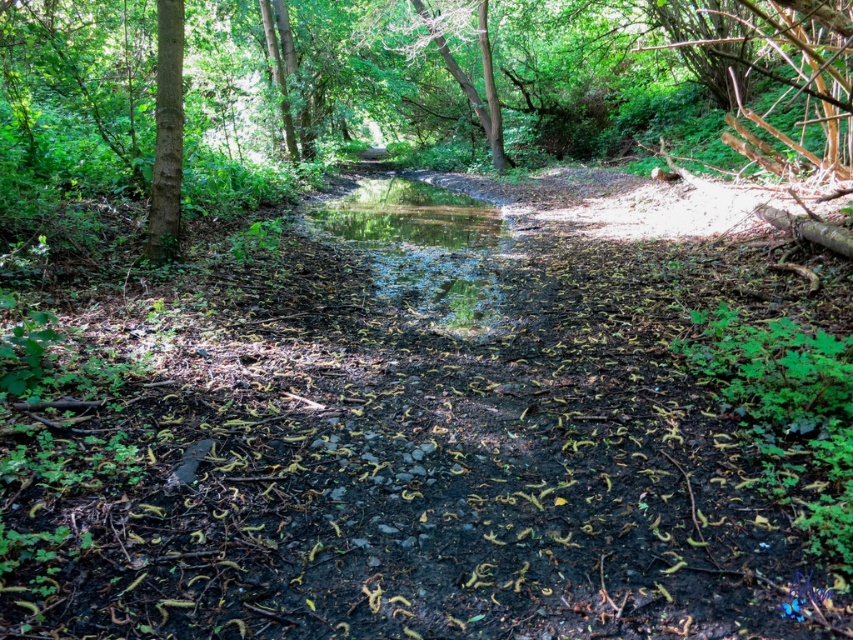
Question: Is green reflective water at center bigger than smooth bark tree at left?

Choices:
 (A) yes
 (B) no

Answer: (A)

Question: From the image, what is the correct spatial relationship of green reflective water at center in relation to smooth bark tree at left?

Choices:
 (A) above
 (B) below

Answer: (B)

Question: Which of the following is the closest to the observer?

Choices:
 (A) (453, 278)
 (B) (161, 88)

Answer: (B)

Question: Which object is closer to the camera taking this photo?

Choices:
 (A) green reflective water at center
 (B) smooth bark tree at left

Answer: (A)

Question: Where is green reflective water at center located in relation to smooth bark tree at left in the image?

Choices:
 (A) above
 (B) below

Answer: (B)